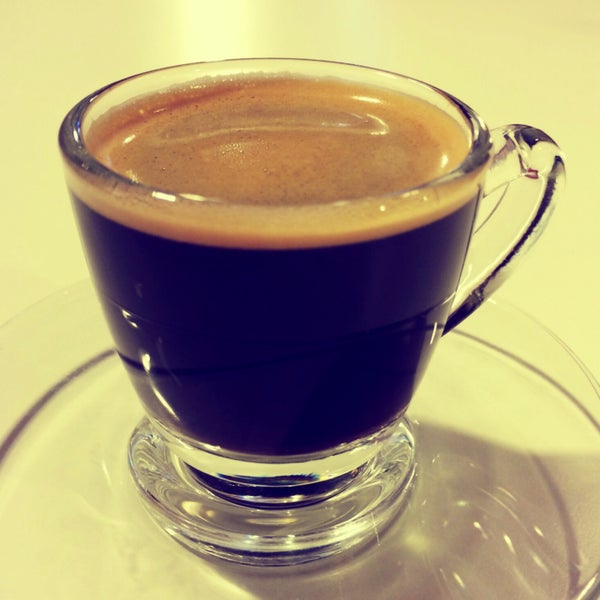
Identify the location of handle. The image size is (600, 600). (524, 252).